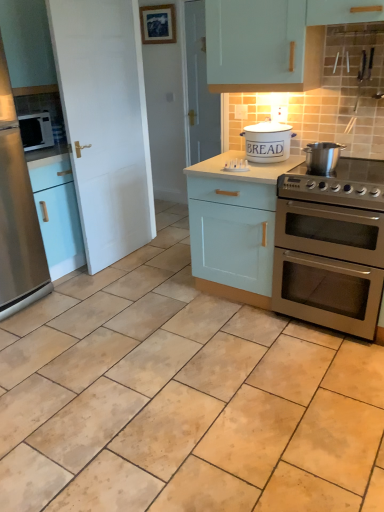
Find the location of a particular element. free space in front of light blue wood cabinet at center is located at coordinates (240, 337).